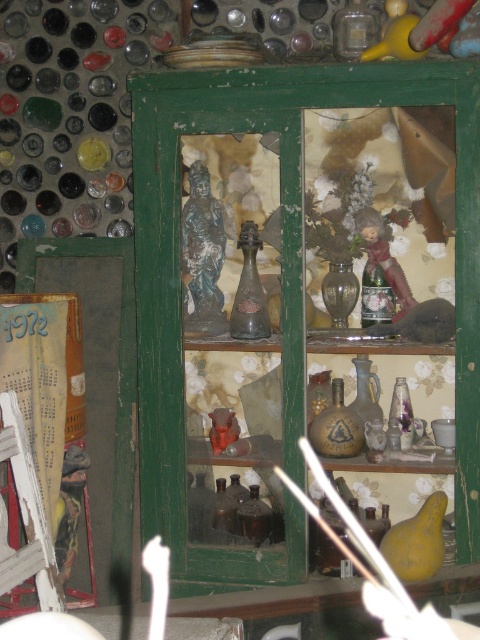
In order to click on matte brown bottle at center in this screenshot , I will do `click(250, 291)`.

Can you confirm if matte brown bottle at center is positioned below matte porcelain doll at center?

Indeed, matte brown bottle at center is positioned under matte porcelain doll at center.

Does point (257, 273) come closer to viewer compared to point (403, 296)?

That is False.

Where is `matte brown bottle at center`? This screenshot has height=640, width=480. matte brown bottle at center is located at coordinates (250, 291).

Can you confirm if green matte cabinet at center is wider than matte porcelain doll at center?

Correct, the width of green matte cabinet at center exceeds that of matte porcelain doll at center.

Who is positioned more to the left, green matte cabinet at center or matte porcelain doll at center?

From the viewer's perspective, green matte cabinet at center appears more on the left side.

Locate an element on the screen. Image resolution: width=480 pixels, height=640 pixels. green matte cabinet at center is located at coordinates (286, 250).

You are a GUI agent. You are given a task and a screenshot of the screen. Output one action in this format:
    pyautogui.click(x=<x>, y=<y>)
    Task: Click on the green matte cabinet at center
    
    Given the screenshot: What is the action you would take?
    pyautogui.click(x=286, y=250)

Between point (160, 260) and point (339, 16), which one is positioned behind?

Positioned behind is point (339, 16).

Between point (295, 280) and point (346, 51), which one is positioned in front?

Point (295, 280) is more forward.

I want to click on green matte cabinet at center, so click(x=286, y=250).